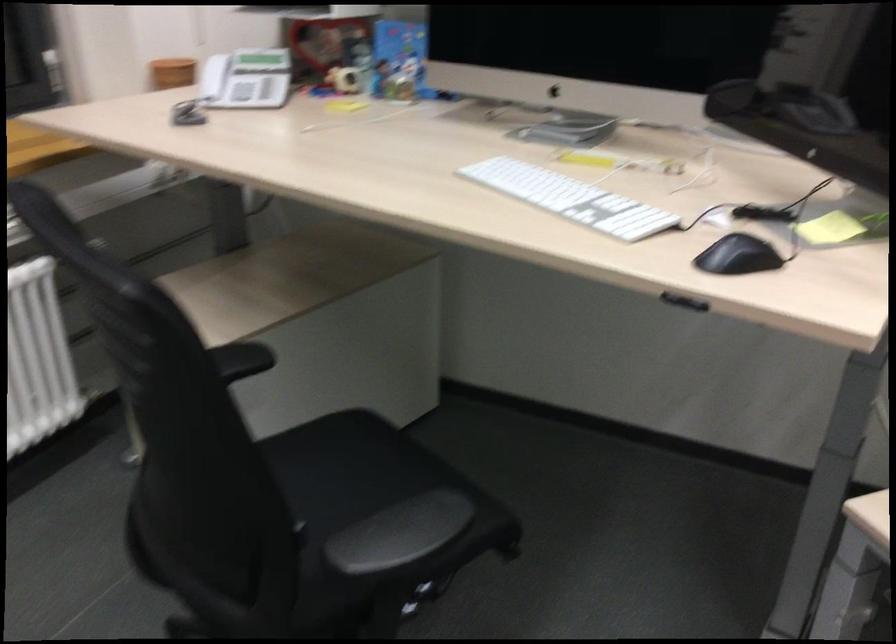
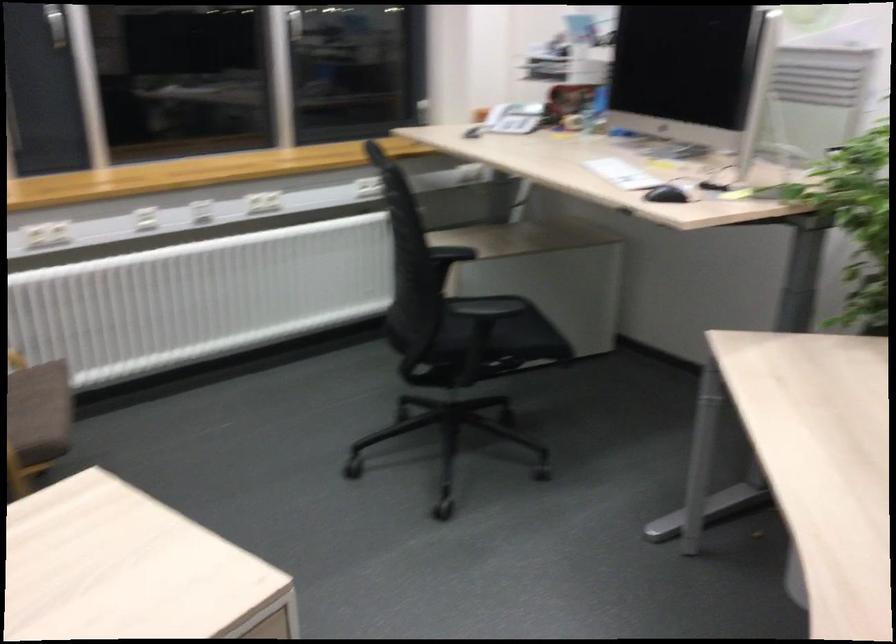
Locate, in the second image, the point that corresponds to the point at 209,87 in the first image.

(496, 115)